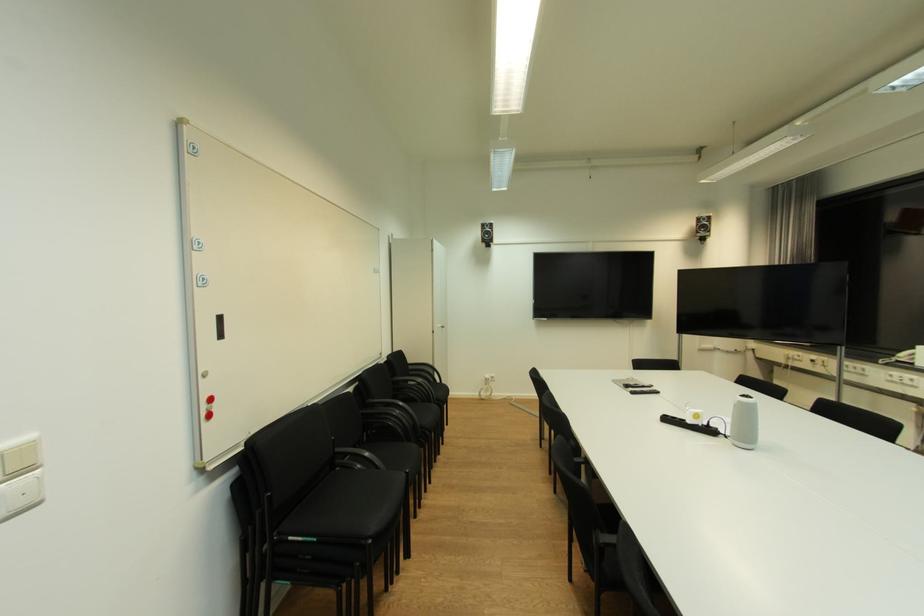
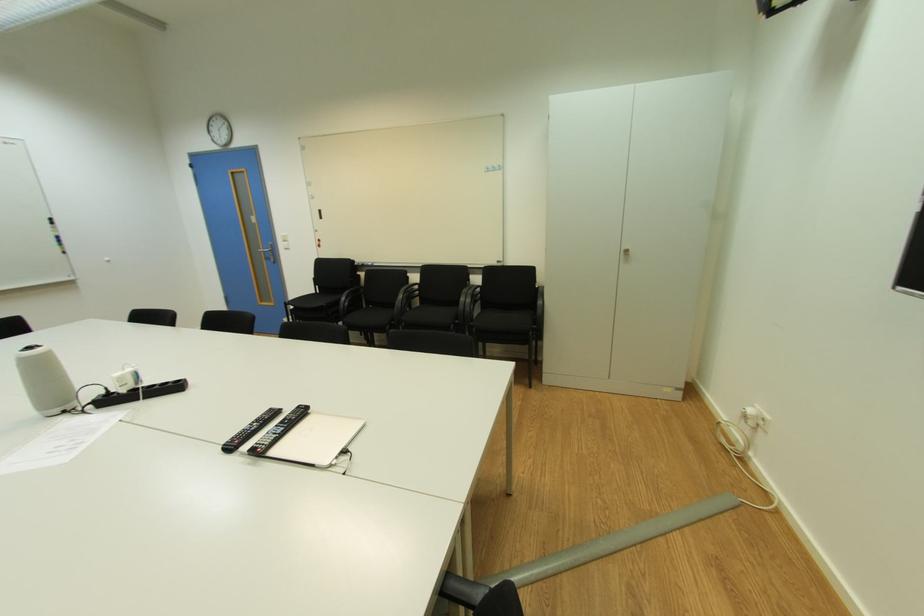
The point at (752, 397) is marked in the first image. Where is the corresponding point in the second image?

(34, 349)